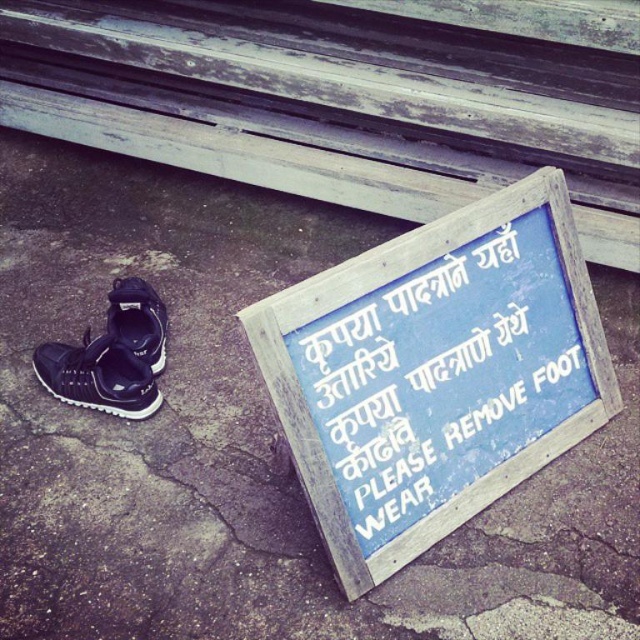
You are standing on the cracked concrete ground and see the blue wooden sign at lower center and the black matte shoe at left. Which object is closer to the ground?

The blue wooden sign at lower center is closer to the ground because it is positioned below the black matte shoe at left.

You are standing at the location shown in the image and want to place your black matte shoe at left on the ground. The blue wooden sign at lower center has important instructions. Which object is closer to you when you are looking at them?

The blue wooden sign at lower center is closer to the viewer than the black matte shoe at left, so the blue wooden sign at lower center is closer to you.